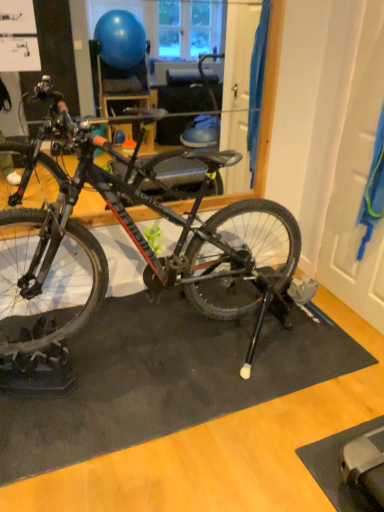
Question: Considering the relative positions of black rubber doormat at center and black matte bicycle at center in the image provided, is black rubber doormat at center to the right of black matte bicycle at center from the viewer's perspective?

Choices:
 (A) yes
 (B) no

Answer: (A)

Question: Considering the relative sizes of black rubber doormat at center and black matte bicycle at center in the image provided, is black rubber doormat at center taller than black matte bicycle at center?

Choices:
 (A) no
 (B) yes

Answer: (A)

Question: Is black rubber doormat at center far away from black matte bicycle at center?

Choices:
 (A) yes
 (B) no

Answer: (B)

Question: Considering the relative sizes of black rubber doormat at center and black matte bicycle at center in the image provided, is black rubber doormat at center shorter than black matte bicycle at center?

Choices:
 (A) yes
 (B) no

Answer: (A)

Question: Does black rubber doormat at center have a lesser width compared to black matte bicycle at center?

Choices:
 (A) yes
 (B) no

Answer: (A)

Question: Is black rubber doormat at center further to camera compared to black matte bicycle at center?

Choices:
 (A) yes
 (B) no

Answer: (A)

Question: Is black rubber doormat at center a part of black matte bicycle at center?

Choices:
 (A) yes
 (B) no

Answer: (B)

Question: From a real-world perspective, is black matte bicycle at center physically above black rubber doormat at center?

Choices:
 (A) yes
 (B) no

Answer: (A)

Question: Is there a large distance between black matte bicycle at center and black rubber doormat at center?

Choices:
 (A) yes
 (B) no

Answer: (B)

Question: Is black matte bicycle at center bigger than black rubber doormat at center?

Choices:
 (A) yes
 (B) no

Answer: (A)

Question: Considering the relative sizes of black matte bicycle at center and black rubber doormat at center in the image provided, is black matte bicycle at center smaller than black rubber doormat at center?

Choices:
 (A) no
 (B) yes

Answer: (A)

Question: Can you see black matte bicycle at center touching black rubber doormat at center?

Choices:
 (A) yes
 (B) no

Answer: (B)

Question: Considering the positions of black matte bicycle at center and black rubber doormat at center in the image, is black matte bicycle at center wider or thinner than black rubber doormat at center?

Choices:
 (A) thin
 (B) wide

Answer: (B)